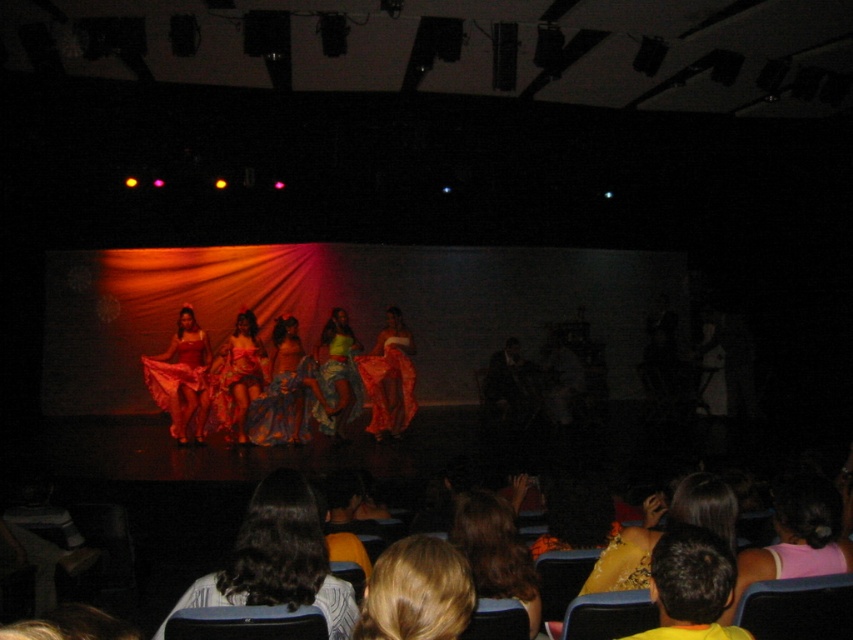
Can you confirm if shiny yellow dress at center is positioned to the left of fluffy white sweater at lower center?

Yes, shiny yellow dress at center is to the left of fluffy white sweater at lower center.

Consider the image. Is shiny yellow dress at center smaller than fluffy white sweater at lower center?

Actually, shiny yellow dress at center might be larger than fluffy white sweater at lower center.

Describe the element at coordinates (335, 376) in the screenshot. I see `shiny yellow dress at center` at that location.

I want to click on shiny yellow dress at center, so click(x=335, y=376).

Is shiny red dress at center thinner than shiny satin dress at center?

No, shiny red dress at center is not thinner than shiny satin dress at center.

Does shiny red dress at center have a greater height compared to shiny satin dress at center?

Correct, shiny red dress at center is much taller as shiny satin dress at center.

Between point (166, 410) and point (296, 387), which one is positioned in front?

Positioned in front is point (296, 387).

The height and width of the screenshot is (640, 853). Find the location of `shiny red dress at center`. shiny red dress at center is located at coordinates (183, 378).

Is yellow fabric at lower right further to the viewer compared to shiny yellow dress at center?

No, it is in front of shiny yellow dress at center.

Image resolution: width=853 pixels, height=640 pixels. Describe the element at coordinates (691, 586) in the screenshot. I see `yellow fabric at lower right` at that location.

Is point (665, 541) more distant than point (321, 339)?

No, (665, 541) is closer to viewer.

This screenshot has width=853, height=640. In order to click on yellow fabric at lower right in this screenshot , I will do `click(691, 586)`.